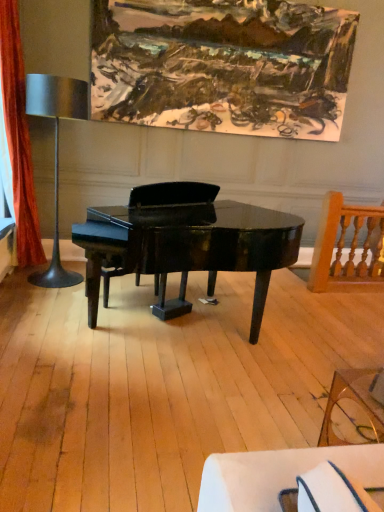
This screenshot has width=384, height=512. What are the coordinates of `transparent glass coffee table at lower right` in the screenshot? It's located at (353, 401).

In the scene shown: Measure the distance between point (x=128, y=208) and camera.

Point (x=128, y=208) and camera are 2.85 meters apart.

Measure the distance between point (10,39) and camera.

Point (10,39) is 11.67 feet from camera.

Where is `wooden spindle chair at right`? wooden spindle chair at right is located at coordinates (344, 246).

Where is `transparent glass coffee table at lower right`? This screenshot has height=512, width=384. transparent glass coffee table at lower right is located at coordinates (353, 401).

Locate an element on the screen. This screenshot has height=512, width=384. coffee table lying in front of the metallic silver table lamp at left is located at coordinates (x=353, y=401).

Is transparent glass coffee table at lower right wider than metallic silver table lamp at left?

Incorrect, the width of transparent glass coffee table at lower right does not surpass that of metallic silver table lamp at left.

Based on the photo, from a real-world perspective, is transparent glass coffee table at lower right physically above metallic silver table lamp at left?

No, from a real-world perspective, transparent glass coffee table at lower right is not over metallic silver table lamp at left

Based on their sizes in the image, would you say transparent glass coffee table at lower right is bigger or smaller than metallic silver table lamp at left?

Considering their sizes, transparent glass coffee table at lower right takes up less space than metallic silver table lamp at left.

Would you say orange velvet curtain at left contains oil paint canvas at upper center?

No, oil paint canvas at upper center is located outside of orange velvet curtain at left.

Who is taller, orange velvet curtain at left or oil paint canvas at upper center?

Standing taller between the two is orange velvet curtain at left.

From a real-world perspective, is orange velvet curtain at left under oil paint canvas at upper center?

Yes, from a real-world perspective, orange velvet curtain at left is beneath oil paint canvas at upper center.

Is orange velvet curtain at left in contact with oil paint canvas at upper center?

orange velvet curtain at left and oil paint canvas at upper center are clearly separated.

Which of these two, transparent glass coffee table at lower right or glossy black piano at center, is wider?

With larger width is glossy black piano at center.

How distant is transparent glass coffee table at lower right from glossy black piano at center?

3.54 feet.

Considering the positions of objects transparent glass coffee table at lower right and glossy black piano at center in the image provided, who is more to the left, transparent glass coffee table at lower right or glossy black piano at center?

glossy black piano at center.

Is point (350, 395) closer or farther from the camera than point (146, 217)?

Point (350, 395).

Which of these two, metallic silver table lamp at left or oil paint canvas at upper center, stands shorter?

oil paint canvas at upper center.

Can you tell me how much metallic silver table lamp at left and oil paint canvas at upper center differ in facing direction?

2.09 degrees.

Which point is more forward, (x=56, y=102) or (x=313, y=47)?

The point (x=56, y=102) is more forward.

In the image, there is a wooden spindle chair at right. Where is `curtain above it (from the image's perspective)`? The height and width of the screenshot is (512, 384). curtain above it (from the image's perspective) is located at coordinates (18, 136).

From a real-world perspective, is wooden spindle chair at right above or below orange velvet curtain at left?

In terms of real-world spatial position, wooden spindle chair at right is below orange velvet curtain at left.

From the image's perspective, which is above, wooden spindle chair at right or orange velvet curtain at left?

orange velvet curtain at left is shown above in the image.

Based on the photo, between wooden spindle chair at right and orange velvet curtain at left, which one has smaller size?

wooden spindle chair at right is smaller.

Is metallic silver table lamp at left closer to camera compared to orange velvet curtain at left?

No, the depth of metallic silver table lamp at left is greater than that of orange velvet curtain at left.

Considering the sizes of objects metallic silver table lamp at left and orange velvet curtain at left in the image provided, who is smaller, metallic silver table lamp at left or orange velvet curtain at left?

orange velvet curtain at left.

How different are the orientations of metallic silver table lamp at left and orange velvet curtain at left in degrees?

The angular difference between metallic silver table lamp at left and orange velvet curtain at left is 90.5 degrees.

How distant is metallic silver table lamp at left from orange velvet curtain at left?

18.94 inches.

Can you tell me how much glossy black piano at center and transparent glass coffee table at lower right differ in facing direction?

The angle between the facing direction of glossy black piano at center and the facing direction of transparent glass coffee table at lower right is 32.1 degrees.

Does glossy black piano at center have a larger size compared to transparent glass coffee table at lower right?

Indeed, glossy black piano at center has a larger size compared to transparent glass coffee table at lower right.

Measure the distance from glossy black piano at center to transparent glass coffee table at lower right.

glossy black piano at center and transparent glass coffee table at lower right are 3.54 feet apart from each other.

Is glossy black piano at center taller than transparent glass coffee table at lower right?

Correct, glossy black piano at center is much taller as transparent glass coffee table at lower right.

This screenshot has height=512, width=384. Identify the location of coffee table below the metallic silver table lamp at left (from a real-world perspective). (353, 401).

Where is `curtain on the left of oil paint canvas at upper center`? This screenshot has height=512, width=384. curtain on the left of oil paint canvas at upper center is located at coordinates (18, 136).

Based on their spatial positions, is transparent glass coffee table at lower right or oil paint canvas at upper center closer to wooden spindle chair at right?

oil paint canvas at upper center is positioned closer to the anchor wooden spindle chair at right.

Based on their spatial positions, is wooden spindle chair at right or orange velvet curtain at left closer to transparent glass coffee table at lower right?

Based on the image, wooden spindle chair at right appears to be nearer to transparent glass coffee table at lower right.

Estimate the real-world distances between objects in this image. Which object is closer to transparent glass coffee table at lower right, oil paint canvas at upper center or metallic silver table lamp at left?

metallic silver table lamp at left.

Looking at the image, which one is located closer to orange velvet curtain at left, oil paint canvas at upper center or transparent glass coffee table at lower right?

oil paint canvas at upper center is positioned closer to the anchor orange velvet curtain at left.

Which object lies nearer to the anchor point glossy black piano at center, orange velvet curtain at left or transparent glass coffee table at lower right?

transparent glass coffee table at lower right is closer to glossy black piano at center.

Consider the image. From the image, which object appears to be nearer to glossy black piano at center, transparent glass coffee table at lower right or wooden spindle chair at right?

The object closer to glossy black piano at center is transparent glass coffee table at lower right.

Estimate the real-world distances between objects in this image. Which object is closer to wooden spindle chair at right, oil paint canvas at upper center or orange velvet curtain at left?

The object closer to wooden spindle chair at right is oil paint canvas at upper center.

Based on their spatial positions, is wooden spindle chair at right or orange velvet curtain at left closer to metallic silver table lamp at left?

orange velvet curtain at left lies closer to metallic silver table lamp at left than the other object.

At what (x,y) coordinates should I click in order to perform the action: click on picture frame located between metallic silver table lamp at left and wooden spindle chair at right in the left-right direction. Please return your answer as a coordinate pair (x, y). This screenshot has height=512, width=384. Looking at the image, I should click on (222, 66).

The image size is (384, 512). I want to click on piano between transparent glass coffee table at lower right and wooden spindle chair at right in the front-back direction, so click(188, 247).

Where is `chair between oil paint canvas at upper center and transparent glass coffee table at lower right vertically`? This screenshot has width=384, height=512. chair between oil paint canvas at upper center and transparent glass coffee table at lower right vertically is located at coordinates (344, 246).

Locate an element on the screen. The width and height of the screenshot is (384, 512). table lamp located between orange velvet curtain at left and wooden spindle chair at right in the left-right direction is located at coordinates (56, 153).